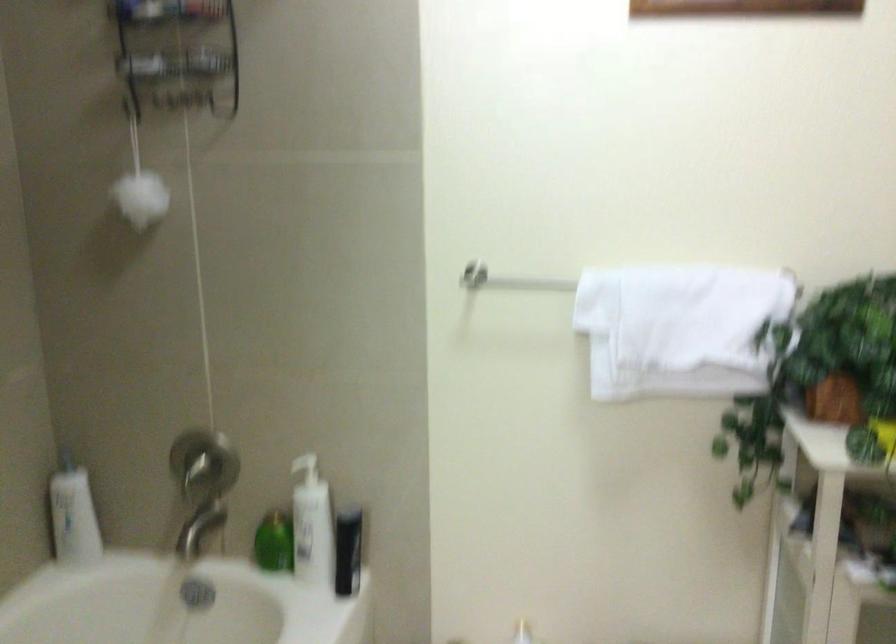
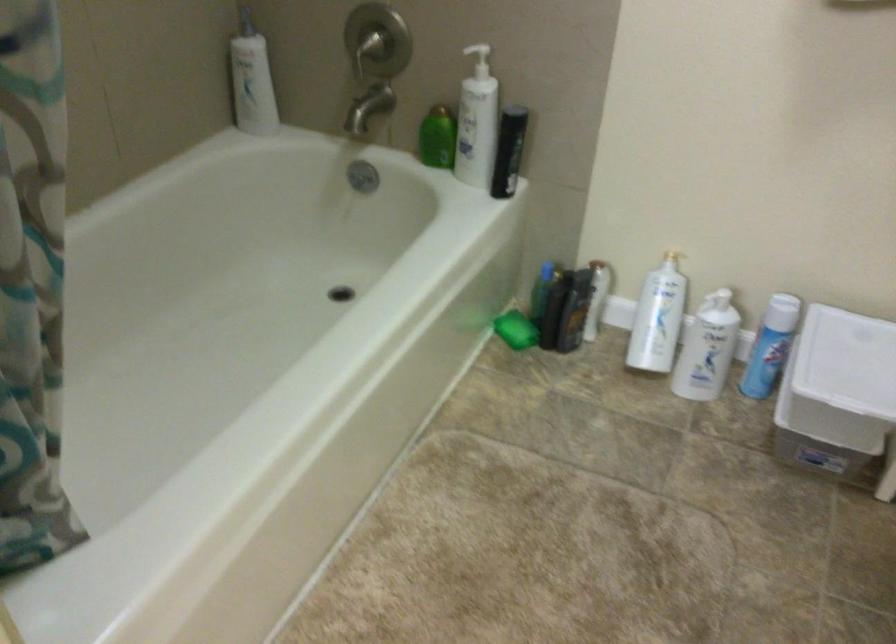
In the second image, find the point that corresponds to (x=314, y=529) in the first image.

(477, 122)